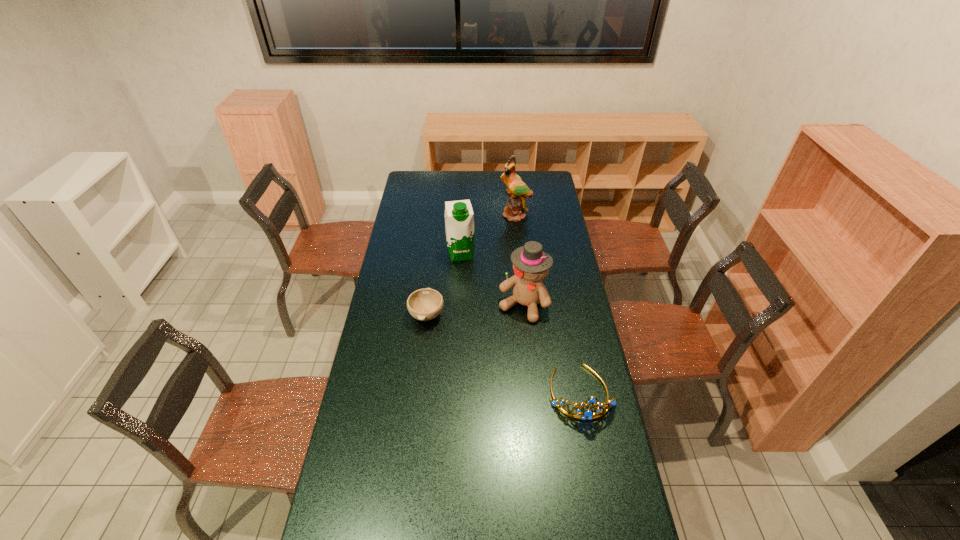
Where is `free space between the soya milk and the bowl`? The height and width of the screenshot is (540, 960). free space between the soya milk and the bowl is located at coordinates (444, 284).

In order to click on empty space that is in between the second farthest object and the bowl in this screenshot , I will do `click(444, 284)`.

Identify which object is located as the fourth nearest to the rag_doll. Please provide its 2D coordinates. Your answer should be formatted as a tuple, i.e. [(x, y)], where the tuple contains the x and y coordinates of a point satisfying the conditions above.

[(517, 191)]

This screenshot has width=960, height=540. In order to click on object that stands as the fourth closest to the rag_doll in this screenshot , I will do `click(517, 191)`.

Locate an element on the screen. vacant position in the image that satisfies the following two spatial constraints: 1. on the front side of the rag_doll; 2. on the right side of the soya milk is located at coordinates (458, 305).

Where is `vacant region that satisfies the following two spatial constraints: 1. on the front side of the soya milk; 2. on the left side of the rag_doll`? vacant region that satisfies the following two spatial constraints: 1. on the front side of the soya milk; 2. on the left side of the rag_doll is located at coordinates (458, 305).